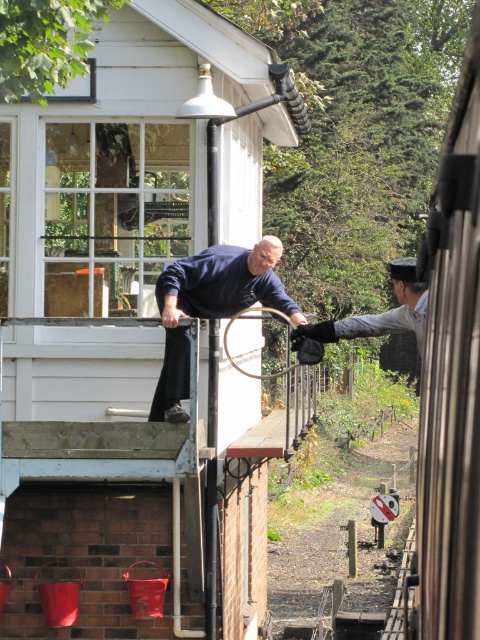
Question: Can you confirm if metallic silver train at right is thinner than dark gray uniform at center?

Choices:
 (A) yes
 (B) no

Answer: (B)

Question: Which point appears farthest from the camera in this image?

Choices:
 (A) (471, 182)
 (B) (206, 308)
 (C) (369, 332)

Answer: (B)

Question: Can you confirm if metallic silver train at right is positioned below blue matte shirt at center?

Choices:
 (A) no
 (B) yes

Answer: (A)

Question: Is blue matte shirt at center positioned at the back of dark gray uniform at center?

Choices:
 (A) yes
 (B) no

Answer: (A)

Question: Which object is farther from the camera taking this photo?

Choices:
 (A) dark gray uniform at center
 (B) metallic silver train at right

Answer: (A)

Question: Which of the following is the closest to the observer?

Choices:
 (A) dark gray uniform at center
 (B) blue matte shirt at center

Answer: (A)